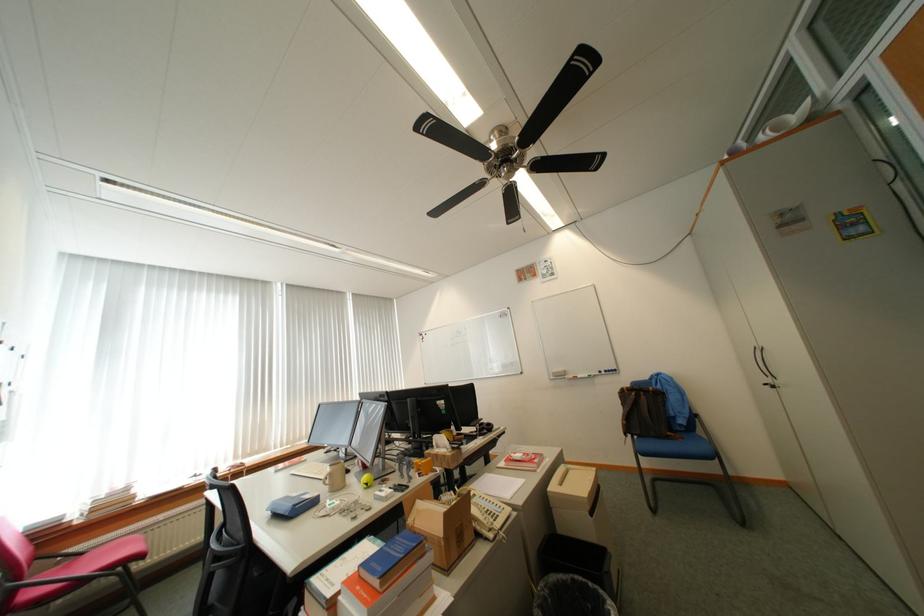
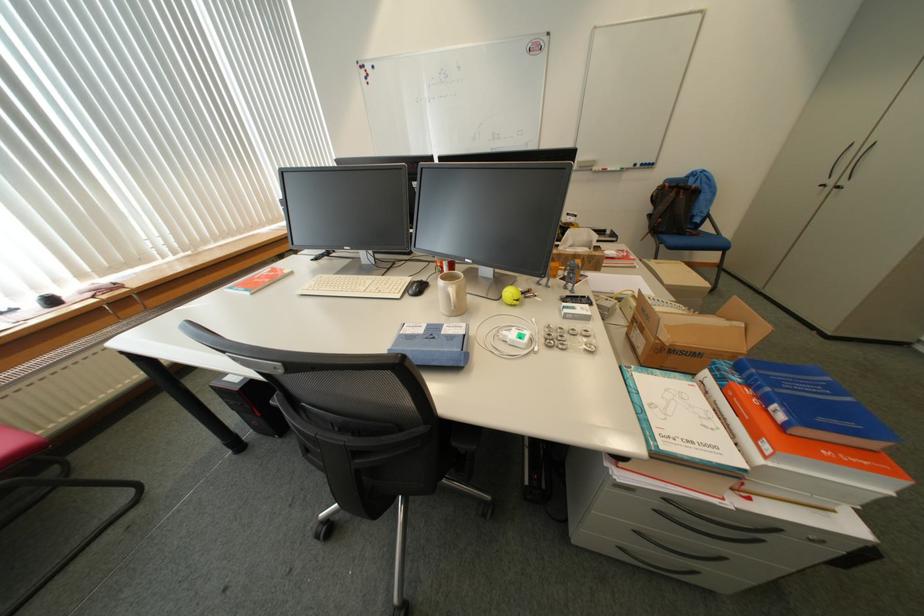
In the second image, find the point that corresponds to point 647,397 in the first image.

(687, 195)